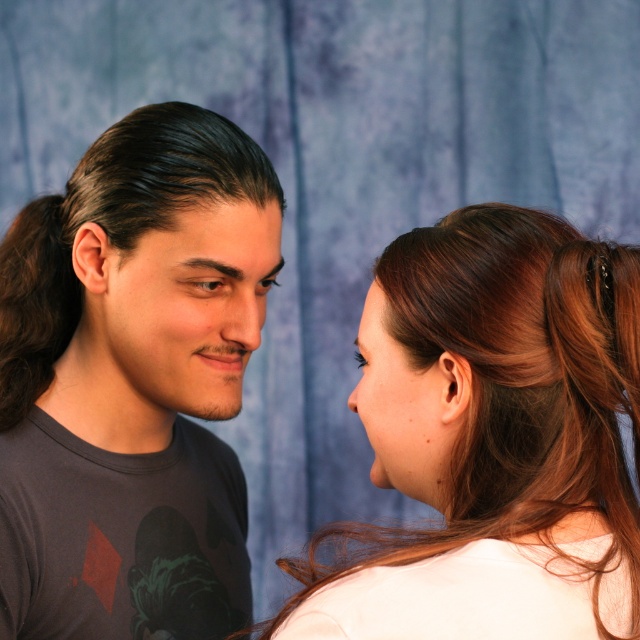
Question: Is brown hair at upper right in front of smooth skin at center?

Choices:
 (A) no
 (B) yes

Answer: (B)

Question: Estimate the real-world distances between objects in this image. Which object is farther from the matte black t-shirt at left?

Choices:
 (A) smooth skin at center
 (B) brown hair at upper right

Answer: (B)

Question: Which object is positioned closest to the brown hair at upper right?

Choices:
 (A) matte black t-shirt at left
 (B) smooth skin at center

Answer: (A)

Question: Observing the image, what is the correct spatial positioning of matte black t-shirt at left in reference to brown hair at upper right?

Choices:
 (A) right
 (B) left

Answer: (B)

Question: Among these objects, which one is nearest to the camera?

Choices:
 (A) matte black t-shirt at left
 (B) brown hair at upper right
 (C) smooth skin at center

Answer: (B)

Question: Can you confirm if matte black t-shirt at left is smaller than brown hair at upper right?

Choices:
 (A) no
 (B) yes

Answer: (A)